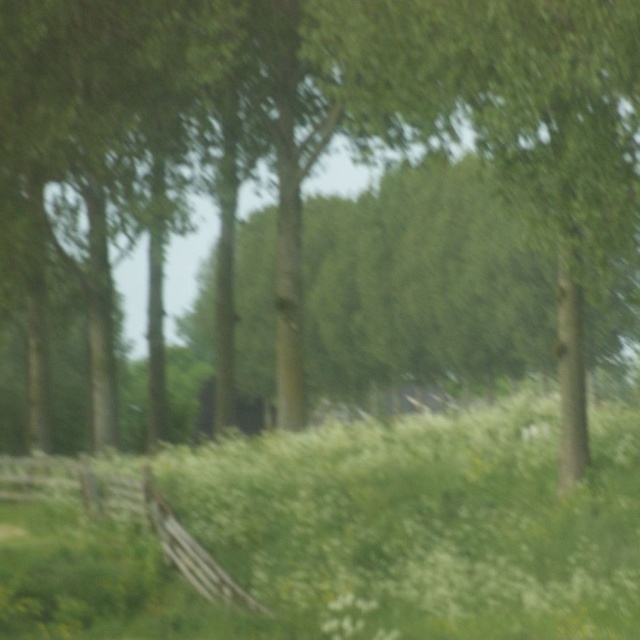
Question: Which of the following is the closest to the observer?

Choices:
 (A) wooden fence at lower left
 (B) green leafy grass at lower center

Answer: (B)

Question: Which point is farther from the camera taking this photo?

Choices:
 (A) (582, 552)
 (B) (13, 490)

Answer: (B)

Question: From the image, what is the correct spatial relationship of green leafy grass at lower center in relation to wooden fence at lower left?

Choices:
 (A) right
 (B) left

Answer: (A)

Question: Considering the relative positions of green leafy grass at lower center and wooden fence at lower left in the image provided, where is green leafy grass at lower center located with respect to wooden fence at lower left?

Choices:
 (A) above
 (B) below

Answer: (A)

Question: Is green leafy grass at lower center behind wooden fence at lower left?

Choices:
 (A) no
 (B) yes

Answer: (A)

Question: Among these objects, which one is nearest to the camera?

Choices:
 (A) wooden fence at lower left
 (B) green leafy grass at lower center

Answer: (B)